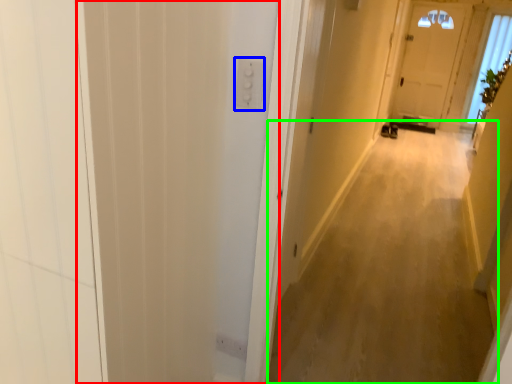
Question: Estimate the real-world distances between objects in this image. Which object is closer to screen door (highlighted by a red box), electric outlet (highlighted by a blue box) or corridor (highlighted by a green box)?

Choices:
 (A) electric outlet
 (B) corridor

Answer: (A)